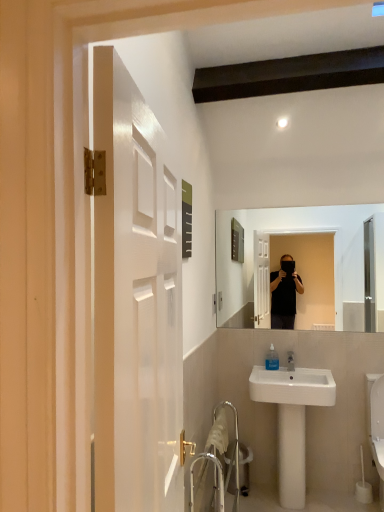
This screenshot has height=512, width=384. Describe the element at coordinates (292, 420) in the screenshot. I see `white ceramic sink at lower right` at that location.

Identify the location of metallic silver trash can at lower center. This screenshot has width=384, height=512. (244, 468).

The height and width of the screenshot is (512, 384). What do you see at coordinates (376, 425) in the screenshot?
I see `white glossy toilet at lower right` at bounding box center [376, 425].

This screenshot has width=384, height=512. In order to click on white ceramic sink at lower right in this screenshot , I will do `click(292, 420)`.

Does white glossy toilet at lower right appear on the left side of metallic silver trash can at lower center?

No.

What are the coordinates of `toilet in front of the metallic silver trash can at lower center` in the screenshot? It's located at (376, 425).

Looking at this image, considering the relative sizes of white glossy toilet at lower right and metallic silver trash can at lower center in the image provided, is white glossy toilet at lower right taller than metallic silver trash can at lower center?

Indeed, white glossy toilet at lower right has a greater height compared to metallic silver trash can at lower center.

Considering the positions of objects white glossy toilet at lower right and metallic silver trash can at lower center in the image provided, who is in front, white glossy toilet at lower right or metallic silver trash can at lower center?

Positioned in front is white glossy toilet at lower right.

Is point (284, 471) behind point (381, 377)?

No, (284, 471) is in front of (381, 377).

Is white ceramic sink at lower right thinner than white glossy toilet at lower right?

Yes, white ceramic sink at lower right is thinner than white glossy toilet at lower right.

In the image, there is a white ceramic sink at lower right. Where is `toilet below it (from the image's perspective)`? toilet below it (from the image's perspective) is located at coordinates (376, 425).

Is white glossy toilet at lower right with white ceramic sink at lower right?

There is a gap between white glossy toilet at lower right and white ceramic sink at lower right.

Between point (383, 424) and point (302, 413), which one is positioned behind?

The point (302, 413) is farther from the camera.

Is white glossy toilet at lower right facing towards white ceramic sink at lower right?

No, white glossy toilet at lower right is not oriented towards white ceramic sink at lower right.

Is white ceramic sink at lower right in front of or behind metallic silver trash can at lower center in the image?

white ceramic sink at lower right is positioned closer to the viewer than metallic silver trash can at lower center.

Considering the points (334, 393) and (234, 493), which point is behind, point (334, 393) or point (234, 493)?

The point (234, 493) is farther from the camera.

Are white ceramic sink at lower right and metallic silver trash can at lower center far apart?

Result: No, white ceramic sink at lower right is in close proximity to metallic silver trash can at lower center.

From the image's perspective, between white ceramic sink at lower right and metallic silver trash can at lower center, who is located below?

From the image's view, metallic silver trash can at lower center is below.

Which is more distant, (248, 461) or (379, 438)?

Positioned behind is point (248, 461).

Can you confirm if metallic silver trash can at lower center is bigger than white glossy toilet at lower right?

No, metallic silver trash can at lower center is not bigger than white glossy toilet at lower right.

From a real-world perspective, is metallic silver trash can at lower center located higher than white glossy toilet at lower right?

No, from a real-world perspective, metallic silver trash can at lower center is not over white glossy toilet at lower right

At what (x,y) coordinates should I click in order to perform the action: click on trash bin/can located below the white glossy toilet at lower right (from the image's perspective). Please return your answer as a coordinate pair (x, y). Looking at the image, I should click on (244, 468).

Considering the relative sizes of metallic silver trash can at lower center and white ceramic sink at lower right in the image provided, is metallic silver trash can at lower center smaller than white ceramic sink at lower right?

Correct, metallic silver trash can at lower center occupies less space than white ceramic sink at lower right.

Which is behind, metallic silver trash can at lower center or white ceramic sink at lower right?

metallic silver trash can at lower center is further away from the camera.

Can you see metallic silver trash can at lower center touching white ceramic sink at lower right?

No, metallic silver trash can at lower center is not with white ceramic sink at lower right.

From their relative heights in the image, would you say metallic silver trash can at lower center is taller or shorter than white ceramic sink at lower right?

metallic silver trash can at lower center is shorter than white ceramic sink at lower right.

You are a GUI agent. You are given a task and a screenshot of the screen. Output one action in this format:
    pyautogui.click(x=<x>, y=<y>)
    Task: Click on the trash bin/can beneath the white glossy toilet at lower right (from a real-world perspective)
    The height and width of the screenshot is (512, 384).
    Given the screenshot: What is the action you would take?
    pyautogui.click(x=244, y=468)

You are a GUI agent. You are given a task and a screenshot of the screen. Output one action in this format:
    pyautogui.click(x=<x>, y=<y>)
    Task: Click on the toilet lying on the right of white ceramic sink at lower right
    The width and height of the screenshot is (384, 512).
    Given the screenshot: What is the action you would take?
    pyautogui.click(x=376, y=425)

Which object lies nearer to the anchor point metallic silver trash can at lower center, white ceramic sink at lower right or white glossy toilet at lower right?

white ceramic sink at lower right is positioned closer to the anchor metallic silver trash can at lower center.

Which object lies nearer to the anchor point metallic silver trash can at lower center, white glossy toilet at lower right or white ceramic sink at lower right?

Among the two, white ceramic sink at lower right is located nearer to metallic silver trash can at lower center.

Estimate the real-world distances between objects in this image. Which object is closer to white glossy toilet at lower right, metallic silver trash can at lower center or white ceramic sink at lower right?

white ceramic sink at lower right.

Based on the photo, when comparing their distances from white ceramic sink at lower right, does metallic silver trash can at lower center or white glossy toilet at lower right seem further?

white glossy toilet at lower right is positioned further to the anchor white ceramic sink at lower right.

Estimate the real-world distances between objects in this image. Which object is further from white ceramic sink at lower right, white glossy toilet at lower right or metallic silver trash can at lower center?

white glossy toilet at lower right.

Based on their spatial positions, is white ceramic sink at lower right or metallic silver trash can at lower center further from white glossy toilet at lower right?

metallic silver trash can at lower center.

Where is `sink located between metallic silver trash can at lower center and white glossy toilet at lower right in the left-right direction`? This screenshot has height=512, width=384. sink located between metallic silver trash can at lower center and white glossy toilet at lower right in the left-right direction is located at coordinates (292, 420).